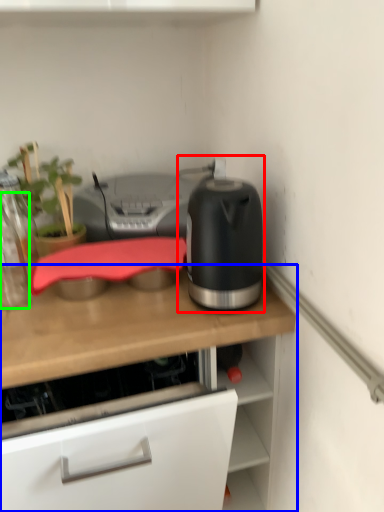
Question: Considering the real-world distances, which object is closest to kitchen appliance (highlighted by a red box)? countertop (highlighted by a blue box) or bottle (highlighted by a green box).

Choices:
 (A) countertop
 (B) bottle

Answer: (A)